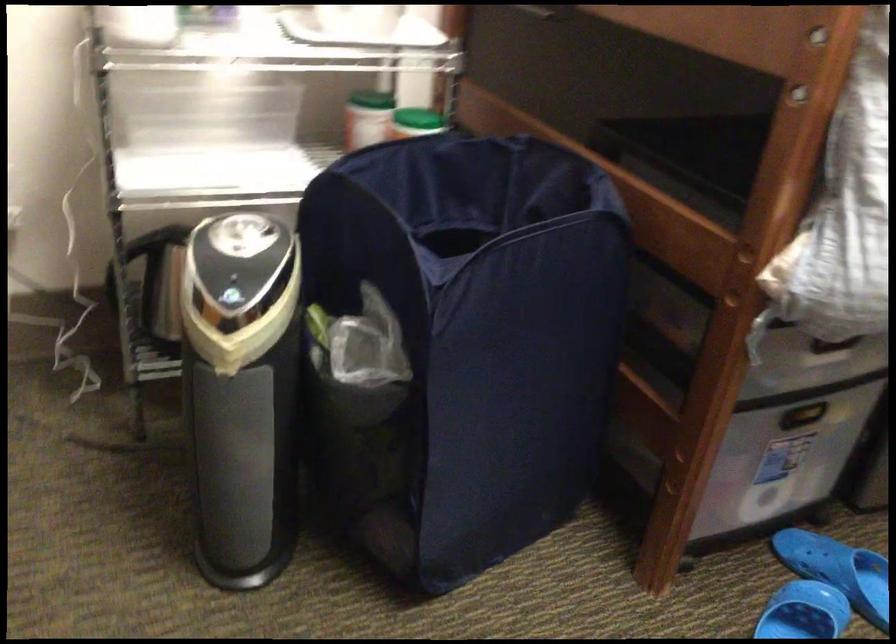
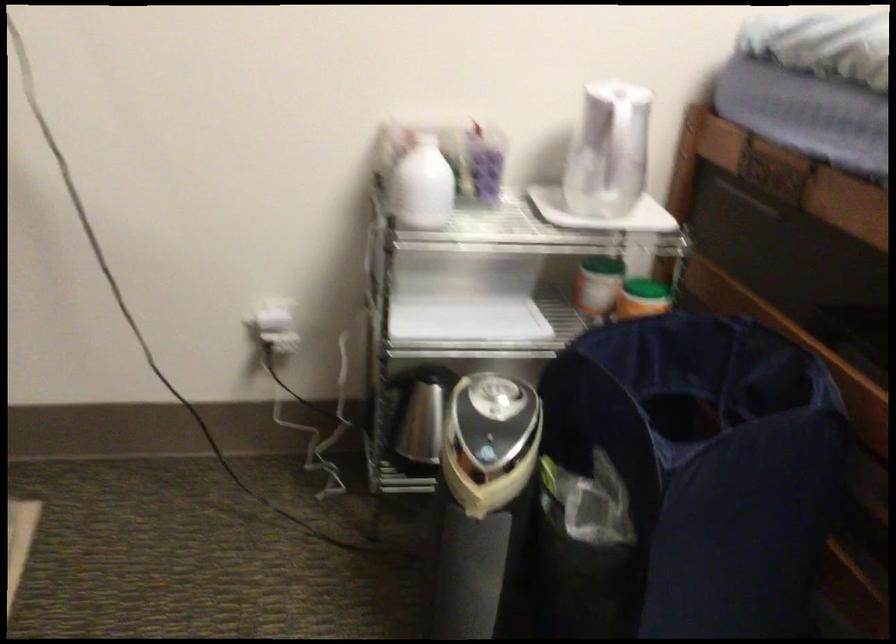
The point at (371, 93) is marked in the first image. Where is the corresponding point in the second image?

(602, 263)